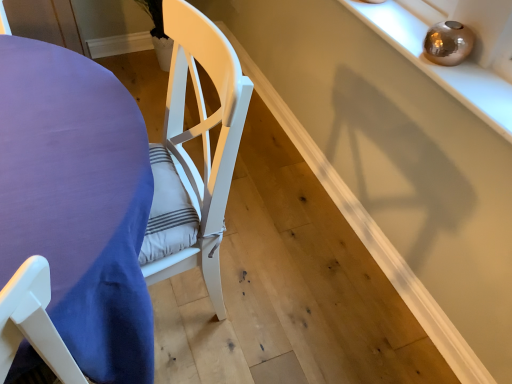
Question: Is point (89, 99) closer or farther from the camera than point (510, 117)?

Choices:
 (A) farther
 (B) closer

Answer: (A)

Question: Is purple fabric table at left wider or thinner than shiny metallic orb at upper right?

Choices:
 (A) thin
 (B) wide

Answer: (B)

Question: From the image's perspective, is purple fabric table at left located above or below shiny metallic orb at upper right?

Choices:
 (A) above
 (B) below

Answer: (B)

Question: In the image, is shiny metallic orb at upper right positioned in front of or behind purple fabric table at left?

Choices:
 (A) behind
 (B) front

Answer: (A)

Question: Which is correct: shiny metallic orb at upper right is inside purple fabric table at left, or outside of it?

Choices:
 (A) inside
 (B) outside

Answer: (B)

Question: Is point (490, 94) closer or farther from the camera than point (104, 231)?

Choices:
 (A) farther
 (B) closer

Answer: (A)

Question: Is shiny metallic orb at upper right taller or shorter than purple fabric table at left?

Choices:
 (A) short
 (B) tall

Answer: (A)